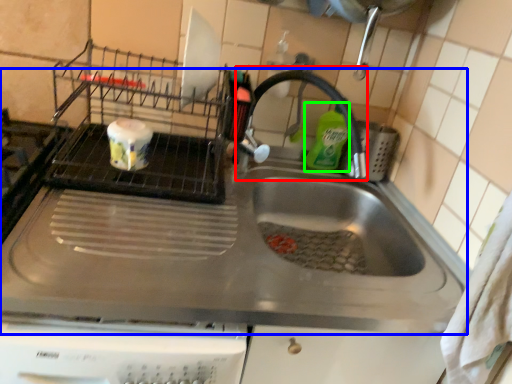
Question: Based on their relative distances, which object is nearer to faucet (highlighted by a red box)? Choose from sink (highlighted by a blue box) and cleaning product (highlighted by a green box).

Choices:
 (A) sink
 (B) cleaning product

Answer: (B)